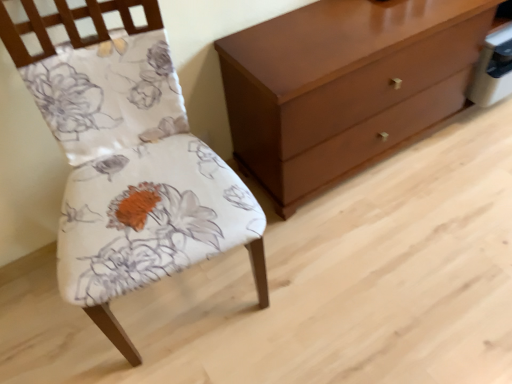
Locate an element on the screen. vacant space underneath floral fabric chair at left (from a real-world perspective) is located at coordinates (185, 304).